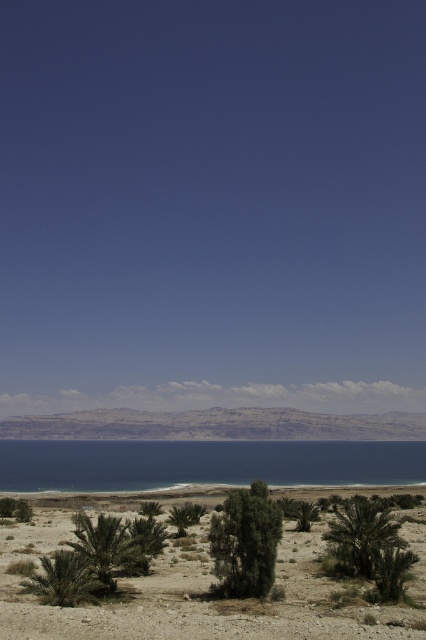
In the scene shown: You are standing at the edge of the Dead Sea and see two points marked in the image. The first point is at coordinates point (331, 448) and the second is at point (351, 508). Which point is closer to you?

Point (331, 448) is closer to you because it is further to the viewer than point (351, 508).